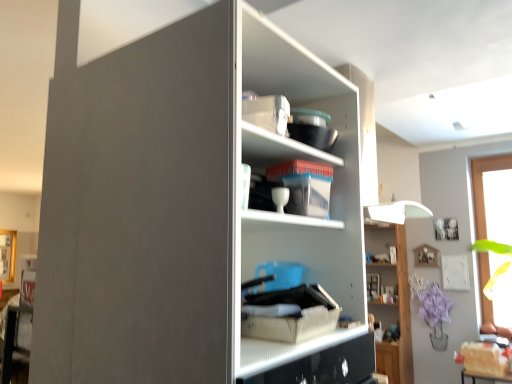
This screenshot has width=512, height=384. What do you see at coordinates (291, 315) in the screenshot? I see `matte cardboard box at center` at bounding box center [291, 315].

What is the approximate height of clear plastic container at upper center, acting as the 1th shelf starting from the front?

clear plastic container at upper center, acting as the 1th shelf starting from the front, is 5.79 inches tall.

Identify the location of clear plastic container at upper center, which is the 2th shelf from bottom to top. (278, 150).

The image size is (512, 384). What do you see at coordinates (188, 209) in the screenshot?
I see `matte gray cupboard at center` at bounding box center [188, 209].

The height and width of the screenshot is (384, 512). In order to click on matte cardboard box at center in this screenshot , I will do `click(291, 315)`.

Who is bigger, wooden shelf at upper right, placed as the 2th shelf when sorted from top to bottom, or transparent glass window at right?

With larger size is transparent glass window at right.

Is transparent glass window at right surrounded by wooden shelf at upper right, which is the second shelf from left to right?

Actually, transparent glass window at right is outside wooden shelf at upper right, which is the second shelf from left to right.

Is wooden shelf at upper right, placed as the 2th shelf when sorted from top to bottom, wider than transparent glass window at right?

No, wooden shelf at upper right, placed as the 2th shelf when sorted from top to bottom, is not wider than transparent glass window at right.

Which point is more distant from viewer, (398,355) or (471,162)?

Positioned behind is point (398,355).

In the scene shown: Which of these two, transparent glass window at right or clear plastic container at upper center, which is the 2th shelf from bottom to top, is smaller?

clear plastic container at upper center, which is the 2th shelf from bottom to top.

Is transparent glass window at right shorter than clear plastic container at upper center, which ranks as the first shelf in top-to-bottom order?

In fact, transparent glass window at right may be taller than clear plastic container at upper center, which ranks as the first shelf in top-to-bottom order.

From the image's perspective, is transparent glass window at right above or below clear plastic container at upper center, acting as the 1th shelf starting from the front?

Based on their image positions, transparent glass window at right is located beneath clear plastic container at upper center, acting as the 1th shelf starting from the front.

Looking at this image, visually, is transparent glass window at right positioned to the left or to the right of clear plastic container at upper center, the 2th shelf in the back-to-front sequence?

From the image, it's evident that transparent glass window at right is to the right of clear plastic container at upper center, the 2th shelf in the back-to-front sequence.

From the image's perspective, is matte white cabinet at center located above or below clear plastic container at upper center, which ranks as the 1th shelf in left-to-right order?

From the image's perspective, matte white cabinet at center appears below clear plastic container at upper center, which ranks as the 1th shelf in left-to-right order.

How many degrees apart are the facing directions of matte white cabinet at center and clear plastic container at upper center, which ranks as the first shelf in top-to-bottom order?

97 degrees separate the facing orientations of matte white cabinet at center and clear plastic container at upper center, which ranks as the first shelf in top-to-bottom order.

Is matte white cabinet at center not near clear plastic container at upper center, which ranks as the 1th shelf in left-to-right order?

matte white cabinet at center is far away from clear plastic container at upper center, which ranks as the 1th shelf in left-to-right order.

At what (x,y) coordinates should I click in order to perform the action: click on cabinet behind the clear plastic container at upper center, which is the 2th shelf from bottom to top. Please return your answer as a coordinate pair (x, y). The width and height of the screenshot is (512, 384). Looking at the image, I should click on 378,238.

Can you confirm if transparent glass window at right is shorter than matte cardboard box at center?

No.

Image resolution: width=512 pixels, height=384 pixels. I want to click on window located below the matte cardboard box at center (from the image's perspective), so click(493, 198).

Is transparent glass window at right wider than matte cardboard box at center?

Yes, transparent glass window at right is wider than matte cardboard box at center.

Could you tell me if transparent glass window at right is turned towards matte cardboard box at center?

Yes, transparent glass window at right is oriented towards matte cardboard box at center.

From a real-world perspective, is wooden shelf at upper right, marked as the first shelf in a bottom-to-top arrangement, positioned above or below matte white cabinet at center?

wooden shelf at upper right, marked as the first shelf in a bottom-to-top arrangement, is below matte white cabinet at center.

Is wooden shelf at upper right, which appears as the 2th shelf when viewed from the front, oriented away from matte white cabinet at center?

That's right, wooden shelf at upper right, which appears as the 2th shelf when viewed from the front, is facing away from matte white cabinet at center.

Is wooden shelf at upper right, marked as the first shelf in a bottom-to-top arrangement, completely or partially outside of matte white cabinet at center?

Yes, wooden shelf at upper right, marked as the first shelf in a bottom-to-top arrangement, is not within matte white cabinet at center.

Between wooden shelf at upper right, arranged as the 1th shelf when viewed from the back, and matte white cabinet at center, which one has smaller width?

A: Thinner between the two is matte white cabinet at center.

In terms of size, does matte gray cupboard at center appear bigger or smaller than transparent glass window at right?

Clearly, matte gray cupboard at center is smaller in size than transparent glass window at right.

Is matte gray cupboard at center thinner than transparent glass window at right?

Yes.

What's the angular difference between matte gray cupboard at center and transparent glass window at right's facing directions?

The angular difference between matte gray cupboard at center and transparent glass window at right is 87.2 degrees.

Which is behind, point (342, 268) or point (483, 167)?

The point (483, 167) is more distant.

Is transparent glass window at right far from matte gray cupboard at center?

That's right, there is a large distance between transparent glass window at right and matte gray cupboard at center.

Can matte gray cupboard at center be found inside transparent glass window at right?

That's incorrect, matte gray cupboard at center is not inside transparent glass window at right.

Which of these two, transparent glass window at right or matte gray cupboard at center, is wider?

transparent glass window at right is wider.

Which is behind, point (496, 285) or point (195, 302)?

The point (496, 285) is farther from the camera.

Locate an element on the screen. Image resolution: width=512 pixels, height=384 pixels. shelf located behind the transparent glass window at right is located at coordinates (391, 302).

The height and width of the screenshot is (384, 512). I want to click on window that appears below the clear plastic container at upper center, which ranks as the first shelf in top-to-bottom order (from the image's perspective), so 493,198.

Looking at the image, which one is located further to transparent glass window at right, matte gray cupboard at center or clear plastic container at upper center, acting as the 1th shelf starting from the front?

matte gray cupboard at center is positioned further to the anchor transparent glass window at right.

Considering their positions, is clear plastic container at upper center, which is the 2th shelf from bottom to top, positioned closer to wooden shelf at upper right, arranged as the 1th shelf when viewed from the back, than matte cardboard box at center?

clear plastic container at upper center, which is the 2th shelf from bottom to top, lies closer to wooden shelf at upper right, arranged as the 1th shelf when viewed from the back, than the other object.

Looking at the image, which one is located further to matte white cabinet at center, clear plastic container at upper center, the 2th shelf in the back-to-front sequence, or wooden shelf at upper right, which is the second shelf from left to right?

clear plastic container at upper center, the 2th shelf in the back-to-front sequence, is positioned further to the anchor matte white cabinet at center.

Looking at the image, which one is located closer to transparent glass window at right, matte gray cupboard at center or matte cardboard box at center?

matte cardboard box at center lies closer to transparent glass window at right than the other object.

Based on their spatial positions, is clear plastic container at upper center, which appears as the 2th shelf when viewed from the right, or matte gray cupboard at center further from matte white cabinet at center?

matte gray cupboard at center.

From the image, which object appears to be farther from clear plastic container at upper center, which is the 2th shelf from bottom to top, wooden shelf at upper right, the first shelf viewed from the right, or matte gray cupboard at center?

wooden shelf at upper right, the first shelf viewed from the right.

Based on their spatial positions, is wooden shelf at upper right, arranged as the 1th shelf when viewed from the back, or clear plastic container at upper center, the 2th shelf in the back-to-front sequence, further from matte cardboard box at center?

wooden shelf at upper right, arranged as the 1th shelf when viewed from the back.

Estimate the real-world distances between objects in this image. Which object is further from wooden shelf at upper right, marked as the first shelf in a bottom-to-top arrangement, matte gray cupboard at center or clear plastic container at upper center, which ranks as the 1th shelf in left-to-right order?

→ Based on the image, matte gray cupboard at center appears to be further to wooden shelf at upper right, marked as the first shelf in a bottom-to-top arrangement.

Image resolution: width=512 pixels, height=384 pixels. What are the coordinates of `window between clear plastic container at upper center, acting as the 1th shelf starting from the front, and matte white cabinet at center from front to back` in the screenshot? It's located at (493, 198).

Locate an element on the screen. This screenshot has width=512, height=384. shelf between matte gray cupboard at center and transparent glass window at right along the z-axis is located at coordinates (278, 150).

I want to click on shelf located between transparent glass window at right and matte white cabinet at center in the depth direction, so click(x=391, y=302).

Locate an element on the screen. The width and height of the screenshot is (512, 384). box between matte gray cupboard at center and wooden shelf at upper right, the first shelf viewed from the right, in the front-back direction is located at coordinates (291, 315).